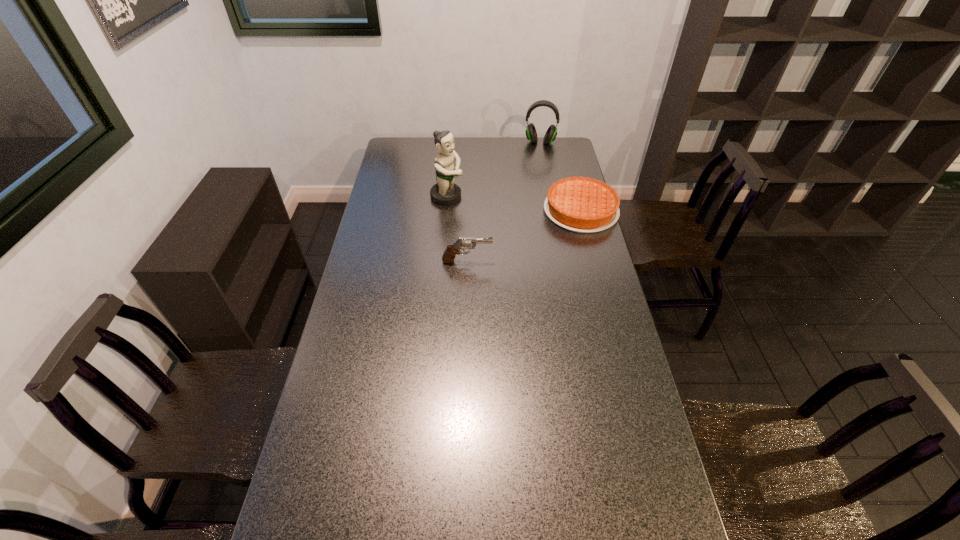
Find the location of a particular element. This screenshot has width=960, height=540. vacant space at the left edge of the desktop is located at coordinates (334, 356).

Find the location of `vacant space at the right edge of the desktop`. vacant space at the right edge of the desktop is located at coordinates (552, 171).

Find the location of a particular element. free spot between the shortest object and the third shortest object is located at coordinates (561, 177).

Locate an element on the screen. This screenshot has height=540, width=960. free space between the tallest object and the farthest object is located at coordinates (493, 170).

Identify the location of vacant area between the tallest object and the nearest object. The height and width of the screenshot is (540, 960). (457, 229).

Find the location of a particular element. empty space between the pie and the figurine is located at coordinates (514, 204).

Image resolution: width=960 pixels, height=540 pixels. I want to click on free space between the pie and the second shortest object, so click(x=524, y=236).

Where is `vacant space in between the pistol and the shortest object`? This screenshot has width=960, height=540. vacant space in between the pistol and the shortest object is located at coordinates (524, 236).

You are a GUI agent. You are given a task and a screenshot of the screen. Output one action in this format:
    pyautogui.click(x=<x>, y=<y>)
    Task: Click on the vacant area that lies between the nearest object and the figurine
    The image size is (960, 540).
    Given the screenshot: What is the action you would take?
    pyautogui.click(x=457, y=229)

Locate an element on the screen. The image size is (960, 540). free space that is in between the figurine and the farthest object is located at coordinates (493, 170).